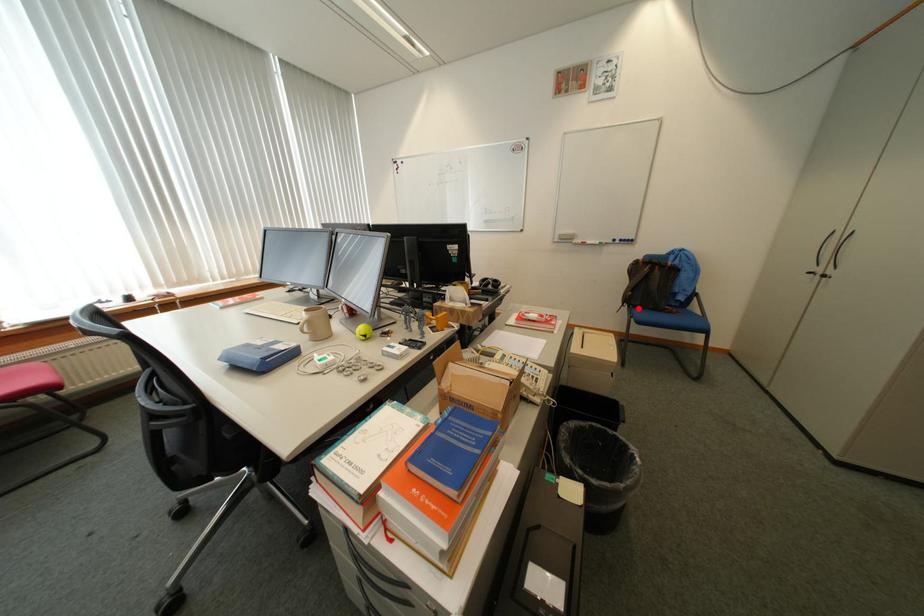
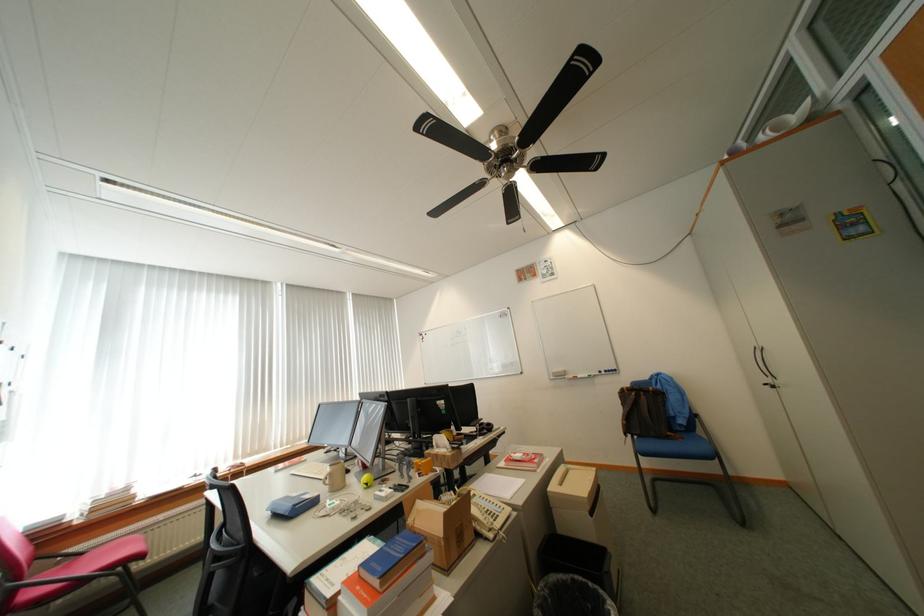
Question: I am providing you with two images of the same scene from different viewpoints. In image1, a red point is highlighted. Considering the same 3D point in image2, which of the following is correct?

Choices:
 (A) It is closer
 (B) It is farther

Answer: (B)